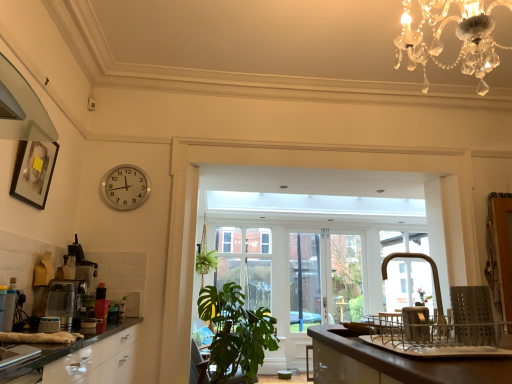
Question: Is brown glossy countertop at lower right at the back of satin silver coffee machine at left, placed as the second coffee machine when sorted from back to front?

Choices:
 (A) yes
 (B) no

Answer: (B)

Question: From the image's perspective, is satin silver coffee machine at left, placed as the second coffee machine when sorted from back to front, on brown glossy countertop at lower right?

Choices:
 (A) no
 (B) yes

Answer: (B)

Question: Is satin silver coffee machine at left, placed as the second coffee machine when sorted from back to front, completely or partially outside of brown glossy countertop at lower right?

Choices:
 (A) yes
 (B) no

Answer: (A)

Question: From a real-world perspective, is satin silver coffee machine at left, which is counted as the first coffee machine, starting from the front, beneath brown glossy countertop at lower right?

Choices:
 (A) yes
 (B) no

Answer: (B)

Question: Considering the relative sizes of satin silver coffee machine at left, placed as the second coffee machine when sorted from back to front, and brown glossy countertop at lower right in the image provided, is satin silver coffee machine at left, placed as the second coffee machine when sorted from back to front, shorter than brown glossy countertop at lower right?

Choices:
 (A) yes
 (B) no

Answer: (A)

Question: Is clear glass door at center taller or shorter than satin silver coffee machine at left, positioned as the 1th coffee machine in back-to-front order?

Choices:
 (A) short
 (B) tall

Answer: (B)

Question: From the image's perspective, is clear glass door at center located above or below satin silver coffee machine at left, positioned as the 1th coffee machine in back-to-front order?

Choices:
 (A) above
 (B) below

Answer: (B)

Question: From a real-world perspective, is clear glass door at center physically located above or below satin silver coffee machine at left, positioned as the 1th coffee machine in back-to-front order?

Choices:
 (A) below
 (B) above

Answer: (A)

Question: Is clear glass door at center bigger or smaller than satin silver coffee machine at left, positioned as the 1th coffee machine in back-to-front order?

Choices:
 (A) big
 (B) small

Answer: (A)

Question: Considering the positions of brushed metal faucet at right and satin silver coffee machine at left, the 2th coffee machine when ordered from front to back, in the image, is brushed metal faucet at right taller or shorter than satin silver coffee machine at left, the 2th coffee machine when ordered from front to back,?

Choices:
 (A) tall
 (B) short

Answer: (B)

Question: Is point (419, 254) positioned closer to the camera than point (37, 284)?

Choices:
 (A) closer
 (B) farther

Answer: (B)

Question: Choose the correct answer: Is brushed metal faucet at right inside satin silver coffee machine at left, the 2th coffee machine when ordered from front to back, or outside it?

Choices:
 (A) inside
 (B) outside

Answer: (B)

Question: Is brushed metal faucet at right in front of or behind satin silver coffee machine at left, positioned as the 1th coffee machine in back-to-front order, in the image?

Choices:
 (A) front
 (B) behind

Answer: (A)

Question: Does point (119, 200) appear closer or farther from the camera than point (58, 294)?

Choices:
 (A) farther
 (B) closer

Answer: (A)

Question: Is silver metallic clock at upper left spatially inside satin silver coffee machine at left, placed as the second coffee machine when sorted from back to front, or outside of it?

Choices:
 (A) inside
 (B) outside

Answer: (B)